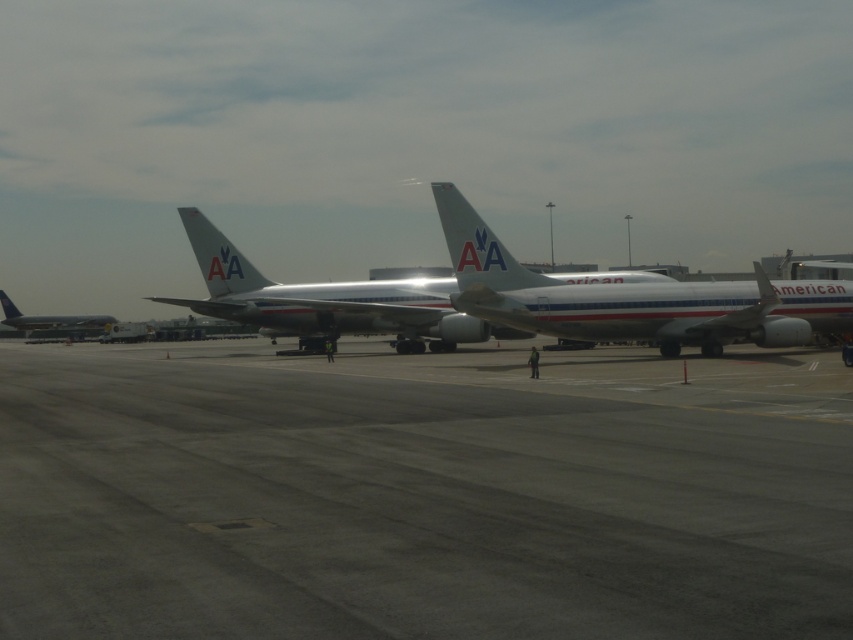
Question: Which object is the farthest from the white metallic airplane at center?

Choices:
 (A) silver metallic airplane at center
 (B) gray asphalt runway at center

Answer: (A)

Question: Which object is positioned farthest from the silver metallic airplane at center?

Choices:
 (A) metallic silver airplane at left
 (B) white metallic airplane at center
 (C) gray asphalt runway at center

Answer: (A)

Question: Does silver metallic airplane at center appear on the right side of metallic silver airplane at left?

Choices:
 (A) no
 (B) yes

Answer: (B)

Question: Is gray asphalt runway at center to the left of metallic silver airplane at left from the viewer's perspective?

Choices:
 (A) yes
 (B) no

Answer: (B)

Question: Which object is farther from the camera taking this photo?

Choices:
 (A) metallic silver airplane at left
 (B) gray asphalt runway at center
 (C) silver metallic airplane at center
 (D) white metallic airplane at center

Answer: (A)

Question: Can you confirm if gray asphalt runway at center is bigger than metallic silver airplane at left?

Choices:
 (A) no
 (B) yes

Answer: (A)